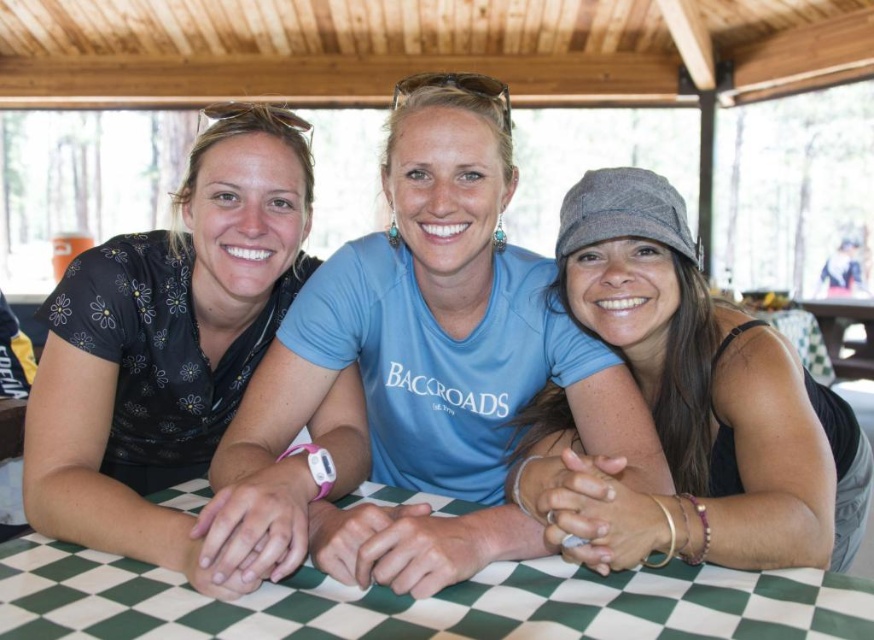
Describe the element at coordinates (689, 404) in the screenshot. I see `gray fabric cap at center` at that location.

Can you confirm if gray fabric cap at center is taller than green checkered table at center?

Yes, gray fabric cap at center is taller than green checkered table at center.

Measure the distance between gray fabric cap at center and camera.

gray fabric cap at center is 75.78 centimeters from camera.

Find the location of `gray fabric cap at center`. gray fabric cap at center is located at coordinates (689, 404).

Between point (47, 600) and point (868, 358), which one is positioned in front?

Positioned in front is point (47, 600).

Where is `green checkered table at center`? green checkered table at center is located at coordinates (424, 604).

Is matte black shirt at center bigger than green checkered table at center?

Yes, matte black shirt at center is bigger than green checkered table at center.

Which is in front, point (609, 412) or point (12, 576)?

Positioned in front is point (12, 576).

This screenshot has width=874, height=640. I want to click on matte black shirt at center, so click(x=420, y=371).